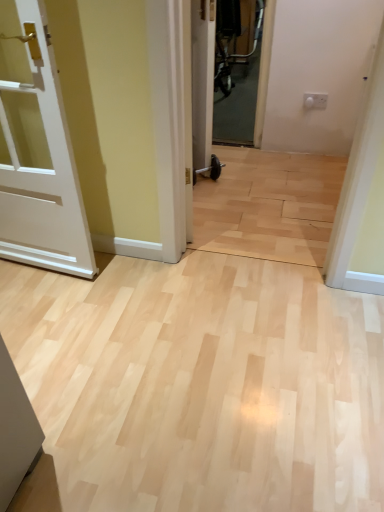
Identify the location of unoccupied area in front of white matte door at left, which appears as the first door when viewed from the left. The height and width of the screenshot is (512, 384). (61, 354).